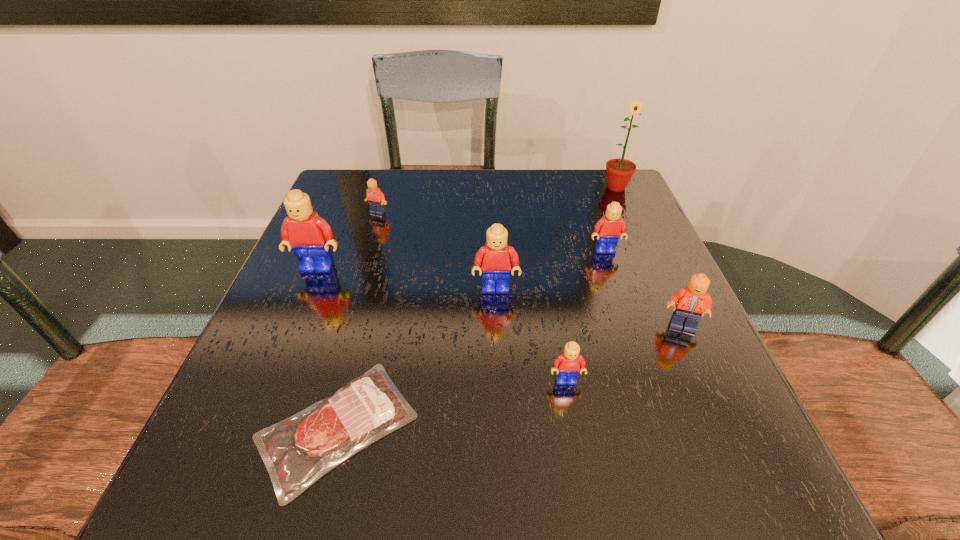
Image resolution: width=960 pixels, height=540 pixels. I want to click on the second farthest object, so click(376, 199).

Locate an element on the screen. The width and height of the screenshot is (960, 540). the left orange Lego is located at coordinates (376, 199).

In order to click on the nearest Lego in this screenshot , I will do `click(567, 365)`.

Where is `the smallest yellow Lego`? This screenshot has width=960, height=540. the smallest yellow Lego is located at coordinates (567, 365).

Locate an element on the screen. the shortest object is located at coordinates (322, 436).

Locate an element on the screen. vacant region located 0.100m on the face of the tallest object is located at coordinates (630, 217).

Identify the location of vacant space located 0.050m on the front-facing side of the fifth nearest object. This screenshot has height=540, width=960. (308, 292).

Locate an element on the screen. vacant region located on the front-facing side of the third yellow Lego from right to left is located at coordinates (501, 435).

Find the location of `vacant space located 0.270m on the front-facing side of the rightmost Lego`. vacant space located 0.270m on the front-facing side of the rightmost Lego is located at coordinates (756, 489).

Locate an element on the screen. free space located 0.130m on the front-facing side of the fifth nearest Lego is located at coordinates (620, 298).